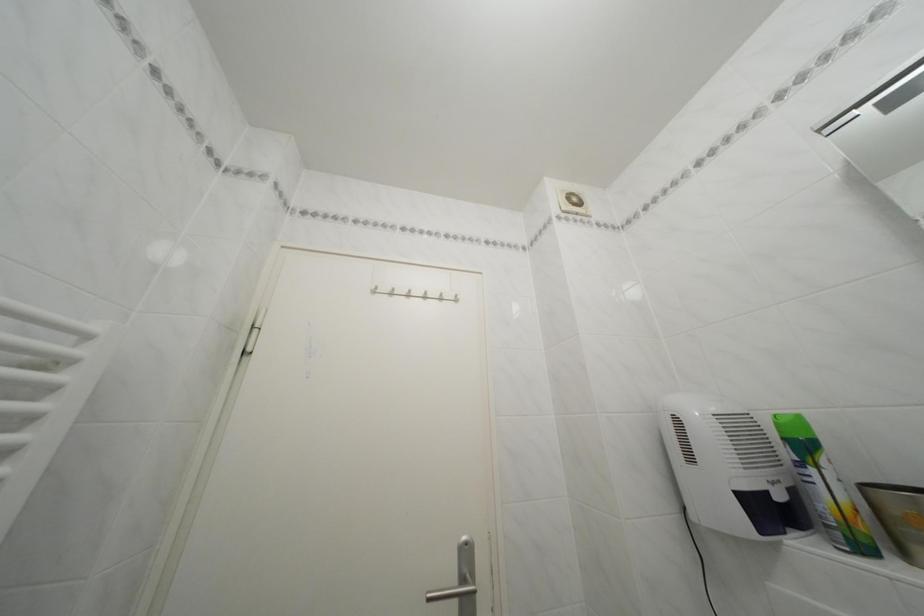
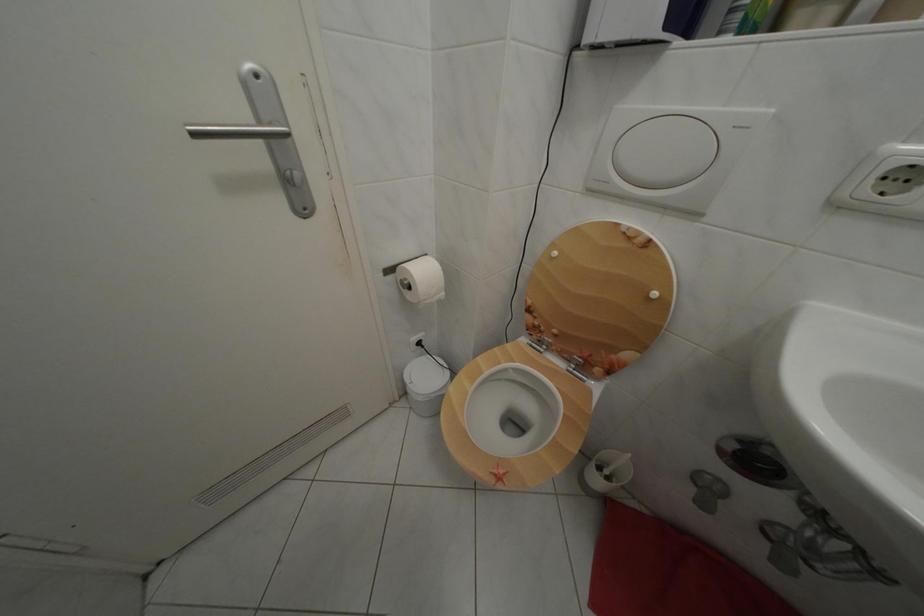
The first image is from the beginning of the video and the second image is from the end. How did the camera likely rotate when shooting the video?

The camera rotated toward right-down.